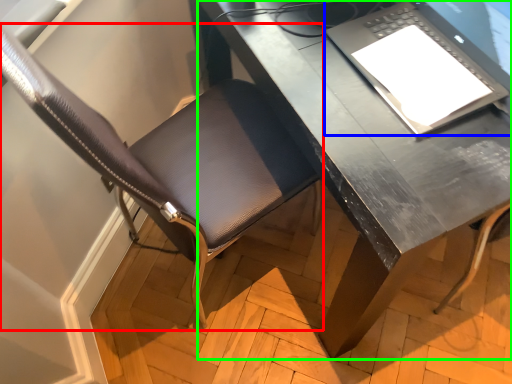
Question: Estimate the real-world distances between objects in this image. Which object is closer to chair (highlighted by a red box), laptop (highlighted by a blue box) or desk (highlighted by a green box)?

Choices:
 (A) laptop
 (B) desk

Answer: (B)